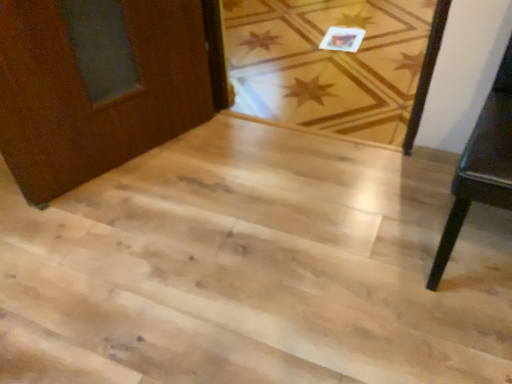
Question: From a real-world perspective, is light wood floor at center physically above dark wood table at right?

Choices:
 (A) yes
 (B) no

Answer: (B)

Question: Is light wood floor at center further to camera compared to dark wood table at right?

Choices:
 (A) yes
 (B) no

Answer: (A)

Question: Could you tell me if light wood floor at center is facing dark wood table at right?

Choices:
 (A) no
 (B) yes

Answer: (A)

Question: From the image's perspective, is light wood floor at center located above dark wood table at right?

Choices:
 (A) yes
 (B) no

Answer: (A)

Question: Does light wood floor at center appear on the right side of dark wood table at right?

Choices:
 (A) yes
 (B) no

Answer: (B)

Question: Would you consider light wood floor at center to be distant from dark wood table at right?

Choices:
 (A) yes
 (B) no

Answer: (A)

Question: Can you confirm if light wood floor at center is positioned to the left of light wood stairs at center?

Choices:
 (A) yes
 (B) no

Answer: (B)

Question: Are light wood floor at center and light wood stairs at center located far from each other?

Choices:
 (A) no
 (B) yes

Answer: (A)

Question: From a real-world perspective, is light wood floor at center beneath light wood stairs at center?

Choices:
 (A) yes
 (B) no

Answer: (A)

Question: Does light wood floor at center have a lesser height compared to light wood stairs at center?

Choices:
 (A) no
 (B) yes

Answer: (A)

Question: Is light wood stairs at center located within light wood floor at center?

Choices:
 (A) no
 (B) yes

Answer: (A)

Question: From the image's perspective, does light wood floor at center appear higher than light wood stairs at center?

Choices:
 (A) yes
 (B) no

Answer: (A)

Question: From a real-world perspective, is dark wood table at right beneath light wood floor at center?

Choices:
 (A) yes
 (B) no

Answer: (B)